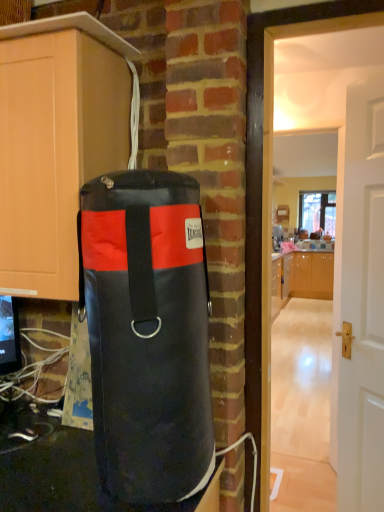
Question: Should I look upward or downward to see black leather punching bag at left?

Choices:
 (A) down
 (B) up

Answer: (A)

Question: From a real-world perspective, is black leather punching bag at left located higher than matte wood cabinet at left, acting as the 1th cabinetry starting from the left?

Choices:
 (A) yes
 (B) no

Answer: (B)

Question: From the image's perspective, is black leather punching bag at left under matte wood cabinet at left, arranged as the second cabinetry when viewed from the right?

Choices:
 (A) yes
 (B) no

Answer: (A)

Question: Is the surface of black leather punching bag at left in direct contact with matte wood cabinet at left, acting as the 1th cabinetry starting from the left?

Choices:
 (A) no
 (B) yes

Answer: (A)

Question: Does black leather punching bag at left appear on the right side of matte wood cabinet at left, arranged as the second cabinetry when viewed from the right?

Choices:
 (A) yes
 (B) no

Answer: (A)

Question: Is black leather punching bag at left shorter than matte wood cabinet at left, marked as the 1th cabinetry in a front-to-back arrangement?

Choices:
 (A) no
 (B) yes

Answer: (A)

Question: Considering the relative sizes of black leather punching bag at left and matte wood cabinet at left, arranged as the second cabinetry when viewed from the right, in the image provided, is black leather punching bag at left thinner than matte wood cabinet at left, arranged as the second cabinetry when viewed from the right,?

Choices:
 (A) yes
 (B) no

Answer: (A)

Question: Does white glossy door at center right have a lesser height compared to glossy wood cabinets at center, arranged as the 2th cabinetry when viewed from the front?

Choices:
 (A) yes
 (B) no

Answer: (B)

Question: Does white glossy door at center right have a larger size compared to glossy wood cabinets at center, placed as the second cabinetry when sorted from left to right?

Choices:
 (A) no
 (B) yes

Answer: (A)

Question: From the image's perspective, is white glossy door at center right on top of glossy wood cabinets at center, the 1th cabinetry from the back?

Choices:
 (A) no
 (B) yes

Answer: (B)

Question: Is white glossy door at center right not inside glossy wood cabinets at center, arranged as the 2th cabinetry when viewed from the front?

Choices:
 (A) yes
 (B) no

Answer: (A)

Question: From a real-world perspective, does white glossy door at center right stand above glossy wood cabinets at center, the 1th cabinetry from the back?

Choices:
 (A) no
 (B) yes

Answer: (B)

Question: Does white glossy door at center right come behind glossy wood cabinets at center, the 1th cabinetry from the back?

Choices:
 (A) yes
 (B) no

Answer: (B)

Question: Considering the relative sizes of glossy wood cabinets at center, placed as the second cabinetry when sorted from left to right, and white glossy door at center right in the image provided, is glossy wood cabinets at center, placed as the second cabinetry when sorted from left to right, taller than white glossy door at center right?

Choices:
 (A) no
 (B) yes

Answer: (A)